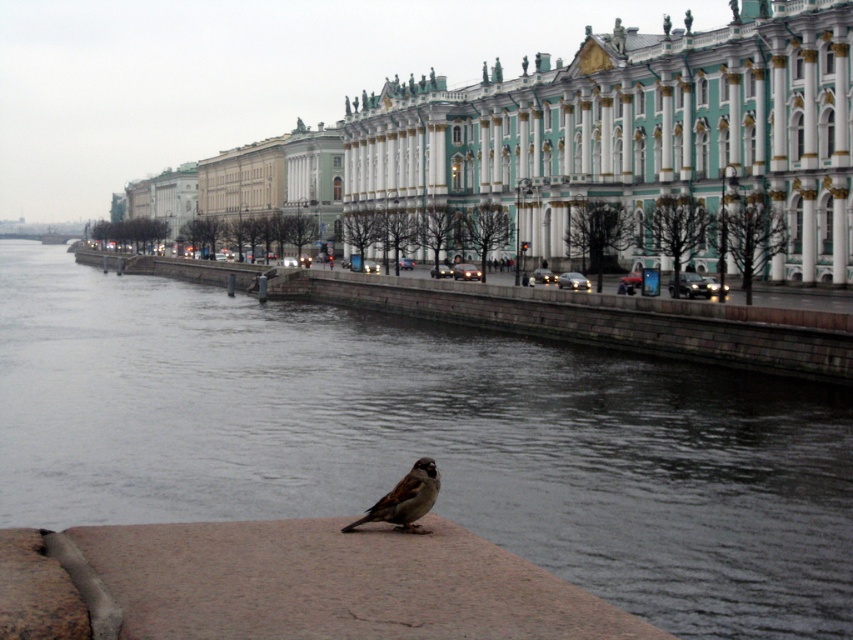
Does gray concrete river at center appear on the left side of brown feathered sparrow at lower center?

Indeed, gray concrete river at center is positioned on the left side of brown feathered sparrow at lower center.

Does gray concrete river at center have a lesser width compared to brown feathered sparrow at lower center?

No, gray concrete river at center is not thinner than brown feathered sparrow at lower center.

Is point (141, 458) behind point (405, 512)?

Yes, it is.

Locate an element on the screen. Image resolution: width=853 pixels, height=640 pixels. gray concrete river at center is located at coordinates (427, 440).

Is green marble palace at center below brown feathered sparrow at lower center?

Incorrect, green marble palace at center is not positioned below brown feathered sparrow at lower center.

Between point (727, 170) and point (375, 506), which one is positioned in front?

Positioned in front is point (375, 506).

Measure the distance between point (799, 93) and camera.

Point (799, 93) and camera are 103.91 meters apart from each other.

Locate an element on the screen. green marble palace at center is located at coordinates (604, 134).

Based on the photo, does gray concrete river at center have a greater height compared to green marble palace at center?

No, gray concrete river at center is not taller than green marble palace at center.

Is gray concrete river at center shorter than green marble palace at center?

Yes.

Between point (612, 381) and point (653, 77), which one is positioned behind?

The point (653, 77) is behind.

You are a GUI agent. You are given a task and a screenshot of the screen. Output one action in this format:
    pyautogui.click(x=<x>, y=<y>)
    Task: Click on the gray concrete river at center
    The image size is (853, 640).
    Given the screenshot: What is the action you would take?
    pyautogui.click(x=427, y=440)